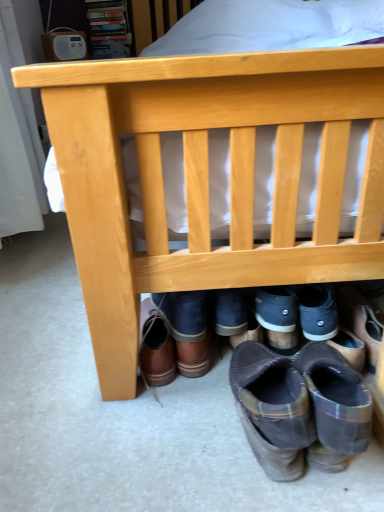
This screenshot has width=384, height=512. What are the coordinates of `brown leather boots at lower center, which appears as the 2th footwear when viewed from the left` in the screenshot? It's located at (188, 329).

Identify the location of dark gray suede boot at center, acting as the fourth footwear starting from the left. Image resolution: width=384 pixels, height=512 pixels. (278, 317).

Describe the element at coordinates (155, 347) in the screenshot. I see `brown leather boot at lower center, which appears as the first footwear when viewed from the left` at that location.

In order to click on brown leather boot at lower center, acting as the fourth footwear starting from the right in this screenshot , I will do `click(155, 347)`.

In order to click on brown leather boots at lower center, positioned as the third footwear in left-to-right order in this screenshot , I will do `click(293, 410)`.

Locate an element on the screen. This screenshot has height=512, width=384. brown leather boots at lower center, which appears as the 2th footwear when viewed from the left is located at coordinates (188, 329).

Can you confirm if dark gray suede boot at center, acting as the fourth footwear starting from the left, is bigger than brown suede boot at lower right?

No.

From a real-world perspective, is dark gray suede boot at center, acting as the fourth footwear starting from the left, above or below brown suede boot at lower right?

dark gray suede boot at center, acting as the fourth footwear starting from the left, is below brown suede boot at lower right.

Which object is wider, dark gray suede boot at center, placed as the first footwear when sorted from right to left, or brown suede boot at lower right?

With larger width is brown suede boot at lower right.

Which is further, [266,293] or [336,380]?

Point [266,293]

Are brown leather boots at lower center, placed as the 2th footwear when sorted from right to left, and brown leather boots at lower center, which appears as the 2th footwear when viewed from the left, far apart?

brown leather boots at lower center, placed as the 2th footwear when sorted from right to left, is actually quite close to brown leather boots at lower center, which appears as the 2th footwear when viewed from the left.

Is brown leather boots at lower center, placed as the 2th footwear when sorted from right to left, positioned with its back to brown leather boots at lower center, which ranks as the 3th footwear in right-to-left order?

No, brown leather boots at lower center, placed as the 2th footwear when sorted from right to left, is not facing away from brown leather boots at lower center, which ranks as the 3th footwear in right-to-left order.

From a real-world perspective, is brown leather boots at lower center, placed as the 2th footwear when sorted from right to left, positioned under brown leather boots at lower center, which appears as the 2th footwear when viewed from the left, based on gravity?

No, from a real-world perspective, brown leather boots at lower center, placed as the 2th footwear when sorted from right to left, is not beneath brown leather boots at lower center, which appears as the 2th footwear when viewed from the left.

Is point (344, 408) less distant than point (272, 454)?

Yes.

From a real-world perspective, which is physically below, brown suede boot at lower right or brown leather boots at lower center, placed as the 2th footwear when sorted from right to left?

From a 3D spatial view, brown leather boots at lower center, placed as the 2th footwear when sorted from right to left, is below.

Measure the distance from brown suede boot at lower right to brown leather boots at lower center, positioned as the third footwear in left-to-right order.

brown suede boot at lower right and brown leather boots at lower center, positioned as the third footwear in left-to-right order, are 1.39 inches apart from each other.

You are a GUI agent. You are given a task and a screenshot of the screen. Output one action in this format:
    pyautogui.click(x=<x>, y=<y>)
    Task: Click on the 2nd footwear to the left of the brown leather boots at lower center, positioned as the third footwear in left-to-right order, starting your count from the anchor
    This screenshot has width=384, height=512.
    Given the screenshot: What is the action you would take?
    pyautogui.click(x=155, y=347)

Is brown leather boot at lower center, which appears as the first footwear when viewed from the left, positioned far away from brown leather boots at lower center, positioned as the third footwear in left-to-right order?

brown leather boot at lower center, which appears as the first footwear when viewed from the left, is actually quite close to brown leather boots at lower center, positioned as the third footwear in left-to-right order.

Is brown leather boots at lower center, positioned as the third footwear in left-to-right order, inside brown leather boot at lower center, which appears as the first footwear when viewed from the left?

That's incorrect, brown leather boots at lower center, positioned as the third footwear in left-to-right order, is not inside brown leather boot at lower center, which appears as the first footwear when viewed from the left.

Looking at this image, considering the relative positions of brown leather boot at lower center, acting as the fourth footwear starting from the right, and brown leather boots at lower center, placed as the 2th footwear when sorted from right to left, in the image provided, is brown leather boot at lower center, acting as the fourth footwear starting from the right, to the left or to the right of brown leather boots at lower center, placed as the 2th footwear when sorted from right to left,?

Clearly, brown leather boot at lower center, acting as the fourth footwear starting from the right, is on the left of brown leather boots at lower center, placed as the 2th footwear when sorted from right to left, in the image.

Can you tell me how much brown leather boot at lower center, acting as the fourth footwear starting from the right, and brown suede boot at lower right differ in facing direction?

The facing directions of brown leather boot at lower center, acting as the fourth footwear starting from the right, and brown suede boot at lower right are 6.38 degrees apart.

Is brown leather boot at lower center, acting as the fourth footwear starting from the right, positioned with its back to brown suede boot at lower right?

No.

Are brown leather boot at lower center, acting as the fourth footwear starting from the right, and brown suede boot at lower right located far from each other?

brown leather boot at lower center, acting as the fourth footwear starting from the right, is near brown suede boot at lower right, not far away.

Is the position of brown leather boot at lower center, which appears as the first footwear when viewed from the left, less distant than that of brown suede boot at lower right?

No, brown leather boot at lower center, which appears as the first footwear when viewed from the left, is further to the viewer.

Based on their sizes in the image, would you say brown leather boots at lower center, placed as the 2th footwear when sorted from right to left, is bigger or smaller than dark gray suede boot at center, acting as the fourth footwear starting from the left?

Clearly, brown leather boots at lower center, placed as the 2th footwear when sorted from right to left, is larger in size than dark gray suede boot at center, acting as the fourth footwear starting from the left.

Considering the sizes of objects brown leather boots at lower center, positioned as the third footwear in left-to-right order, and dark gray suede boot at center, acting as the fourth footwear starting from the left, in the image provided, who is taller, brown leather boots at lower center, positioned as the third footwear in left-to-right order, or dark gray suede boot at center, acting as the fourth footwear starting from the left,?

brown leather boots at lower center, positioned as the third footwear in left-to-right order, is taller.

Considering the relative sizes of brown leather boots at lower center, placed as the 2th footwear when sorted from right to left, and dark gray suede boot at center, acting as the fourth footwear starting from the left, in the image provided, is brown leather boots at lower center, placed as the 2th footwear when sorted from right to left, thinner than dark gray suede boot at center, acting as the fourth footwear starting from the left,?

Incorrect, the width of brown leather boots at lower center, placed as the 2th footwear when sorted from right to left, is not less than that of dark gray suede boot at center, acting as the fourth footwear starting from the left.

Does brown leather boots at lower center, positioned as the third footwear in left-to-right order, come in front of dark gray suede boot at center, acting as the fourth footwear starting from the left?

A: Yes, it is in front of dark gray suede boot at center, acting as the fourth footwear starting from the left.

Does brown leather boots at lower center, which appears as the 2th footwear when viewed from the left, appear on the left side of brown leather boot at lower center, acting as the fourth footwear starting from the right?

No.

Is brown leather boots at lower center, which ranks as the 3th footwear in right-to-left order, oriented away from brown leather boot at lower center, which appears as the first footwear when viewed from the left?

No, brown leather boots at lower center, which ranks as the 3th footwear in right-to-left order, is not facing the opposite direction of brown leather boot at lower center, which appears as the first footwear when viewed from the left.

Is brown leather boots at lower center, which appears as the 2th footwear when viewed from the left, not within brown leather boot at lower center, which appears as the first footwear when viewed from the left?

brown leather boots at lower center, which appears as the 2th footwear when viewed from the left, lies outside brown leather boot at lower center, which appears as the first footwear when viewed from the left,'s area.

From a real-world perspective, between brown leather boots at lower center, which ranks as the 3th footwear in right-to-left order, and brown leather boot at lower center, acting as the fourth footwear starting from the right, who is vertically higher?

brown leather boot at lower center, acting as the fourth footwear starting from the right, from a real-world perspective.

I want to click on shoe located below the dark gray suede boot at center, acting as the fourth footwear starting from the left (from the image's perspective), so click(x=336, y=398).

The image size is (384, 512). Find the location of `the 2nd footwear behind the brown leather boots at lower center, positioned as the third footwear in left-to-right order`. the 2nd footwear behind the brown leather boots at lower center, positioned as the third footwear in left-to-right order is located at coordinates (188, 329).

Looking at the image, which one is located closer to brown leather boots at lower center, placed as the 2th footwear when sorted from right to left, brown leather boots at lower center, which ranks as the 3th footwear in right-to-left order, or brown leather boot at lower center, acting as the fourth footwear starting from the right?

Among the two, brown leather boots at lower center, which ranks as the 3th footwear in right-to-left order, is located nearer to brown leather boots at lower center, placed as the 2th footwear when sorted from right to left.

Based on their spatial positions, is brown suede boot at lower right or brown leather boot at lower center, acting as the fourth footwear starting from the right, further from brown leather boots at lower center, positioned as the third footwear in left-to-right order?

Based on the image, brown leather boot at lower center, acting as the fourth footwear starting from the right, appears to be further to brown leather boots at lower center, positioned as the third footwear in left-to-right order.

When comparing their distances from dark gray suede boot at center, placed as the first footwear when sorted from right to left, does brown suede boot at lower right or brown leather boot at lower center, acting as the fourth footwear starting from the right, seem closer?

brown suede boot at lower right is positioned closer to the anchor dark gray suede boot at center, placed as the first footwear when sorted from right to left.

Based on their spatial positions, is dark gray suede boot at center, placed as the first footwear when sorted from right to left, or brown suede boot at lower right further from brown leather boots at lower center, which ranks as the 3th footwear in right-to-left order?

brown suede boot at lower right.

Considering their positions, is brown leather boots at lower center, positioned as the third footwear in left-to-right order, positioned further to dark gray suede boot at center, placed as the first footwear when sorted from right to left, than brown leather boots at lower center, which ranks as the 3th footwear in right-to-left order?

brown leather boots at lower center, positioned as the third footwear in left-to-right order.

Which object lies nearer to the anchor point dark gray suede boot at center, acting as the fourth footwear starting from the left, brown leather boot at lower center, acting as the fourth footwear starting from the right, or brown leather boots at lower center, which ranks as the 3th footwear in right-to-left order?

brown leather boots at lower center, which ranks as the 3th footwear in right-to-left order, is closer to dark gray suede boot at center, acting as the fourth footwear starting from the left.

From the image, which object appears to be farther from brown leather boot at lower center, which appears as the first footwear when viewed from the left, brown suede boot at lower right or brown leather boots at lower center, placed as the 2th footwear when sorted from right to left?

brown suede boot at lower right is further to brown leather boot at lower center, which appears as the first footwear when viewed from the left.

Estimate the real-world distances between objects in this image. Which object is further from dark gray suede boot at center, placed as the first footwear when sorted from right to left, brown leather boots at lower center, which appears as the 2th footwear when viewed from the left, or brown leather boots at lower center, positioned as the third footwear in left-to-right order?

brown leather boots at lower center, positioned as the third footwear in left-to-right order, lies further to dark gray suede boot at center, placed as the first footwear when sorted from right to left, than the other object.

Locate an element on the screen. footwear located between brown leather boots at lower center, placed as the 2th footwear when sorted from right to left, and brown leather boots at lower center, which ranks as the 3th footwear in right-to-left order, in the depth direction is located at coordinates (155, 347).